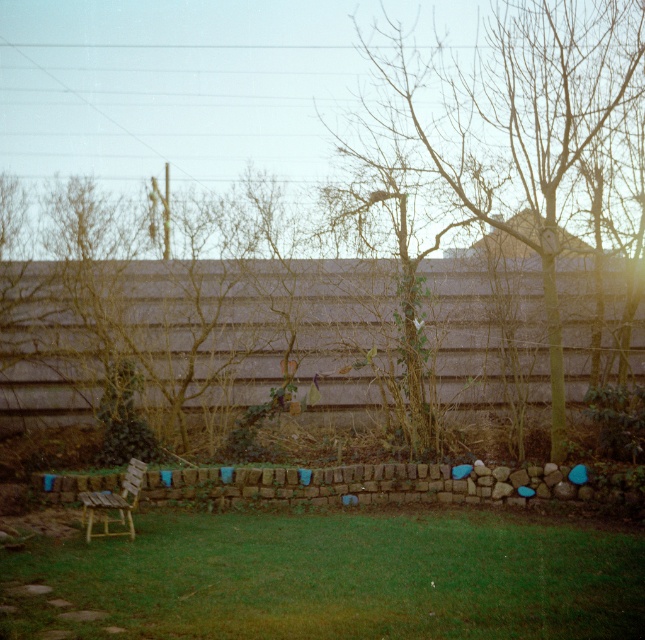
Question: Is green grass at lower left to the right of brown leafless tree at center from the viewer's perspective?

Choices:
 (A) yes
 (B) no

Answer: (B)

Question: Among these points, which one is nearest to the camera?

Choices:
 (A) 362,131
 (B) 86,497
 (C) 464,195
 (D) 244,513

Answer: (B)

Question: Which point is closer to the camera?

Choices:
 (A) bare wood tree at center
 (B) wooden chair at lower left
 (C) brown leafless tree at center
 (D) green grass at lower left

Answer: (D)

Question: In this image, where is bare wood tree at center located relative to wooden chair at lower left?

Choices:
 (A) above
 (B) below

Answer: (A)

Question: Estimate the real-world distances between objects in this image. Which object is farther from the bare wood tree at center?

Choices:
 (A) brown leafless tree at center
 (B) green grass at lower left
 (C) wooden chair at lower left

Answer: (B)

Question: Can you confirm if brown leafless tree at center is smaller than wooden chair at lower left?

Choices:
 (A) no
 (B) yes

Answer: (A)